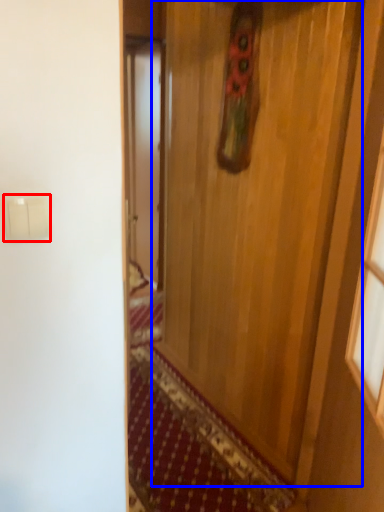
Question: Which of the following is the closest to the observer, light switch (highlighted by a red box) or door (highlighted by a blue box)?

Choices:
 (A) light switch
 (B) door

Answer: (A)